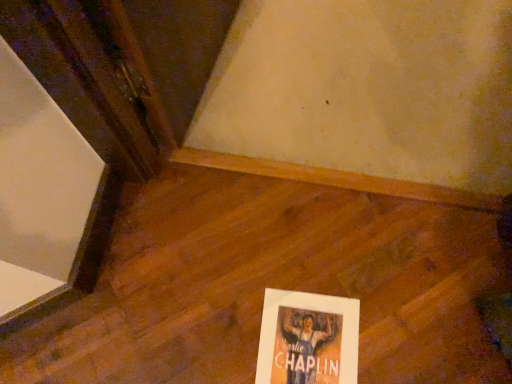
Where is `vacant space situated above wooden floor at center (from a real-world perspective)`? Image resolution: width=512 pixels, height=384 pixels. vacant space situated above wooden floor at center (from a real-world perspective) is located at coordinates (236, 283).